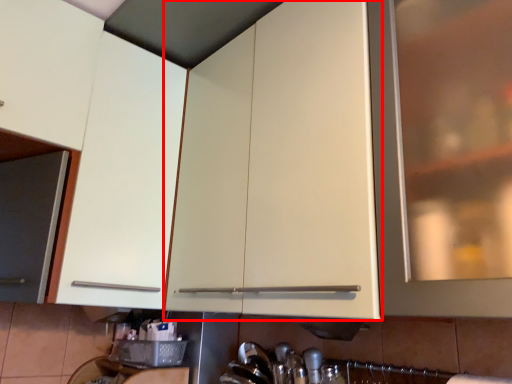
Question: In this image, where is cabinetry (annotated by the red box) located relative to cabinetry?

Choices:
 (A) left
 (B) right

Answer: (B)